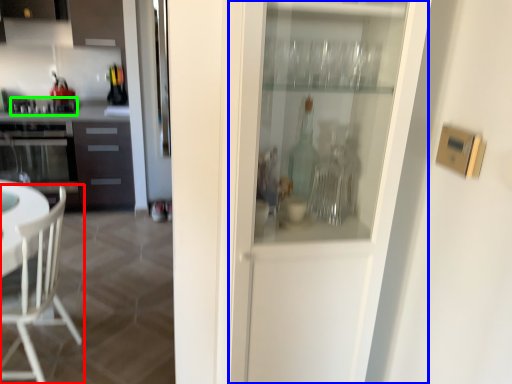
Question: Which is farther away from chair (highlighted by a red box)? screen door (highlighted by a blue box) or appliance (highlighted by a green box)?

Choices:
 (A) screen door
 (B) appliance

Answer: (B)